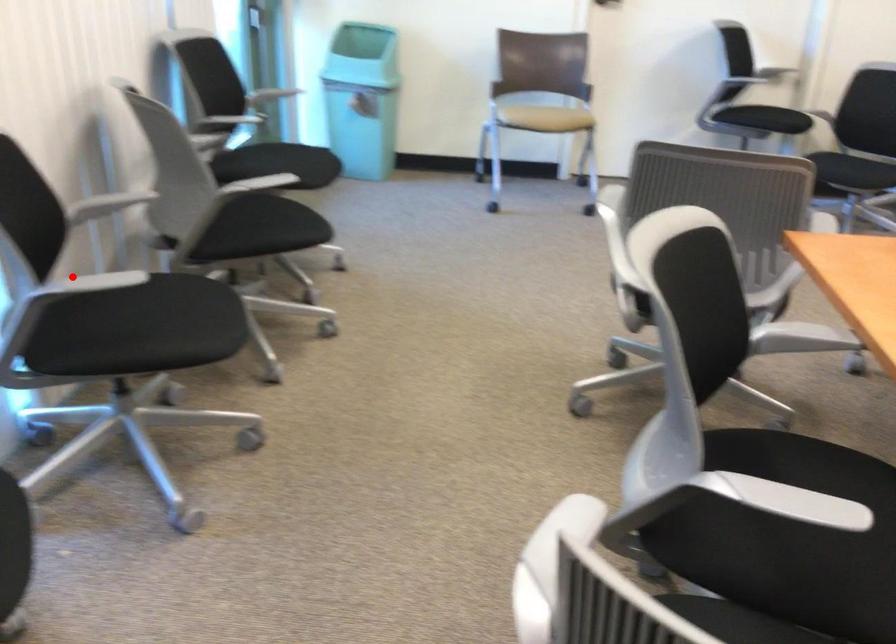
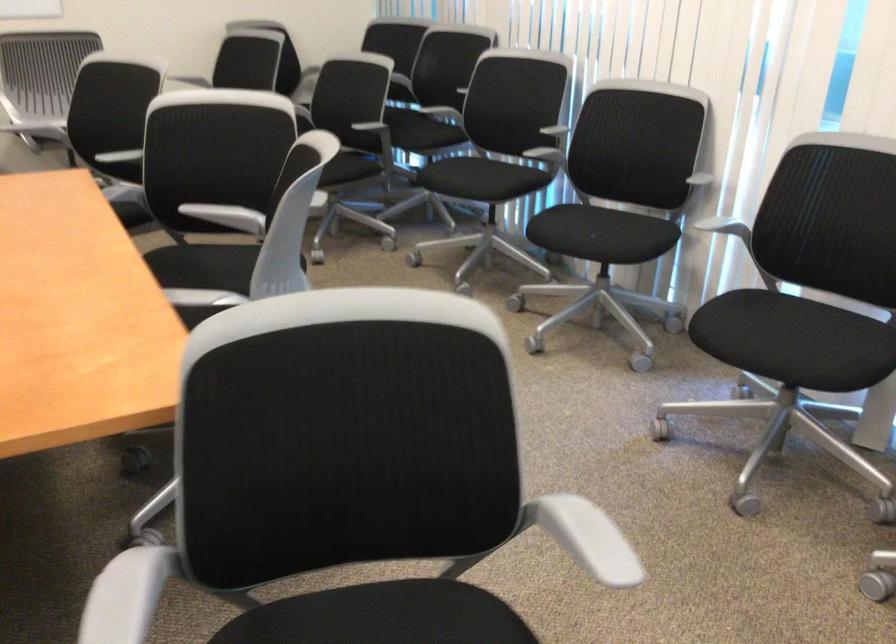
Question: I am providing you with two images of the same scene from different viewpoints. In image1, a red point is highlighted. Considering the same 3D point in image2, which of the following is correct?

Choices:
 (A) It is closer
 (B) It is farther

Answer: (B)